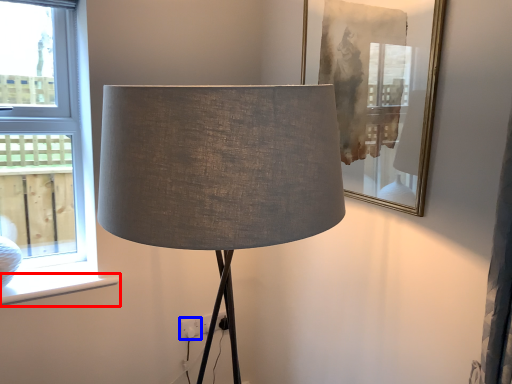
Question: Which object is closer to the camera taking this photo, window sill (highlighted by a red box) or electric outlet (highlighted by a blue box)?

Choices:
 (A) window sill
 (B) electric outlet

Answer: (A)